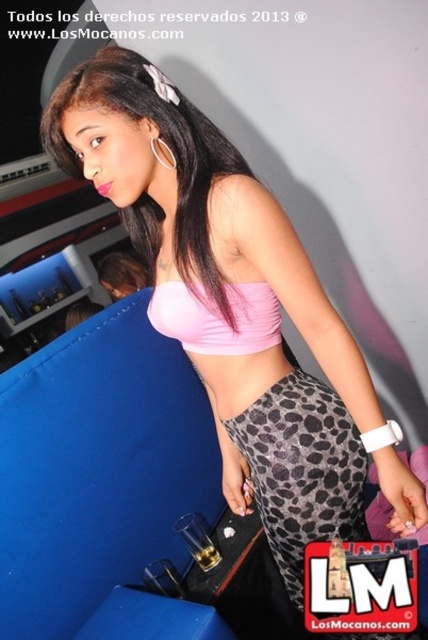
Does leopard print leggings at lower center appear on the right side of pink matte bikini top at center?

Yes, leopard print leggings at lower center is to the right of pink matte bikini top at center.

Does point (299, 609) come behind point (240, 323)?

Yes.

Does point (231, 432) lie behind point (264, 339)?

Yes, point (231, 432) is farther from viewer.

Identify the location of leopard print leggings at lower center. The height and width of the screenshot is (640, 428). (303, 470).